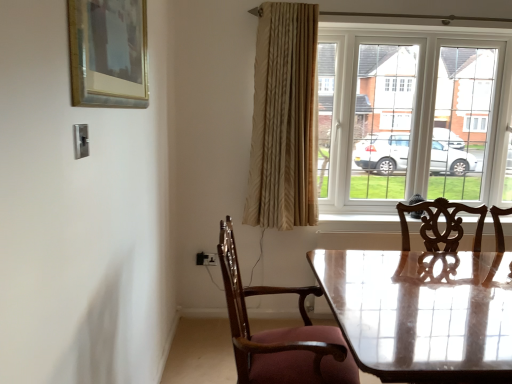
Question: Is beige textured curtain at upper right thinner than glossy wooden table at center?

Choices:
 (A) yes
 (B) no

Answer: (A)

Question: Would you say beige textured curtain at upper right is a long distance from glossy wooden table at center?

Choices:
 (A) yes
 (B) no

Answer: (A)

Question: Could you tell me if beige textured curtain at upper right is facing glossy wooden table at center?

Choices:
 (A) yes
 (B) no

Answer: (B)

Question: Is beige textured curtain at upper right next to glossy wooden table at center?

Choices:
 (A) yes
 (B) no

Answer: (B)

Question: Considering the relative sizes of beige textured curtain at upper right and glossy wooden table at center in the image provided, is beige textured curtain at upper right smaller than glossy wooden table at center?

Choices:
 (A) no
 (B) yes

Answer: (A)

Question: Is white glass window at upper right spatially inside gold-framed painting at upper left, or outside of it?

Choices:
 (A) outside
 (B) inside

Answer: (A)

Question: From a real-world perspective, is white glass window at upper right above or below gold-framed painting at upper left?

Choices:
 (A) below
 (B) above

Answer: (A)

Question: Based on their positions, is white glass window at upper right located to the left or right of gold-framed painting at upper left?

Choices:
 (A) right
 (B) left

Answer: (A)

Question: From their relative heights in the image, would you say white glass window at upper right is taller or shorter than gold-framed painting at upper left?

Choices:
 (A) tall
 (B) short

Answer: (A)

Question: Is gold-framed painting at upper left inside or outside of glossy wooden table at center?

Choices:
 (A) inside
 (B) outside

Answer: (B)

Question: Looking at their shapes, would you say gold-framed painting at upper left is wider or thinner than glossy wooden table at center?

Choices:
 (A) wide
 (B) thin

Answer: (B)

Question: From their relative heights in the image, would you say gold-framed painting at upper left is taller or shorter than glossy wooden table at center?

Choices:
 (A) tall
 (B) short

Answer: (B)

Question: Relative to glossy wooden table at center, is gold-framed painting at upper left in front or behind?

Choices:
 (A) behind
 (B) front

Answer: (B)

Question: Considering the relative positions of white glass window at upper right and beige textured curtain at upper right in the image provided, is white glass window at upper right to the left or to the right of beige textured curtain at upper right?

Choices:
 (A) right
 (B) left

Answer: (A)

Question: Is white glass window at upper right spatially inside beige textured curtain at upper right, or outside of it?

Choices:
 (A) inside
 (B) outside

Answer: (B)